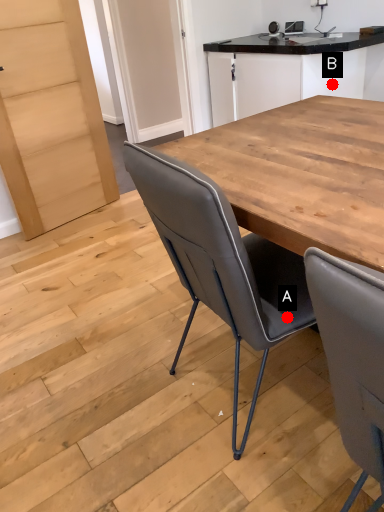
Question: Two points are circled on the image, labeled by A and B beside each circle. Which point is farther from the camera taking this photo?

Choices:
 (A) A is further
 (B) B is further

Answer: (B)